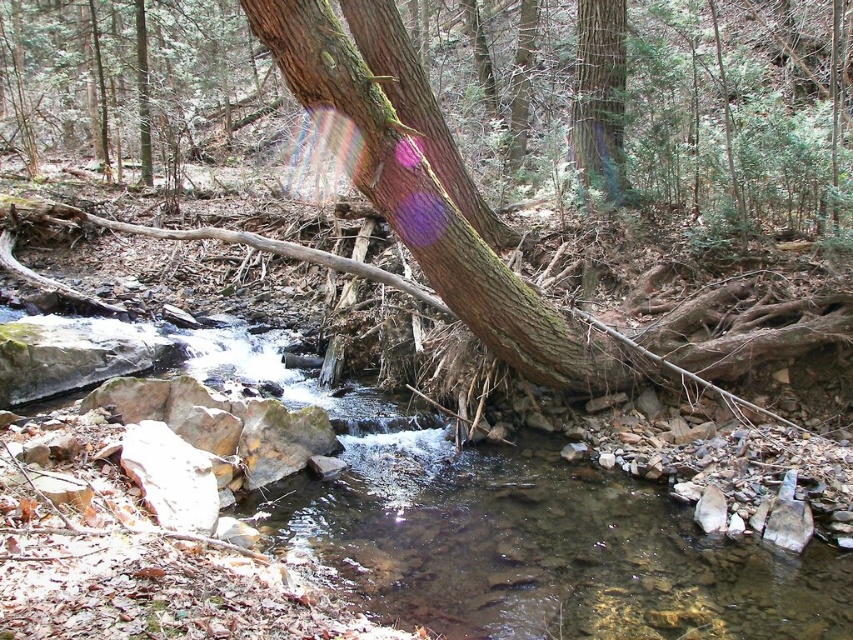
Looking at this image, which of these two, clear water stream at center or green rough bark tree trunk at upper center, stands shorter?

With less height is clear water stream at center.

Which is behind, point (415, 534) or point (612, 154)?

Point (612, 154)

Is point (486, 596) farther from viewer compared to point (575, 65)?

That is False.

Where is `clear water stream at center`? clear water stream at center is located at coordinates (541, 548).